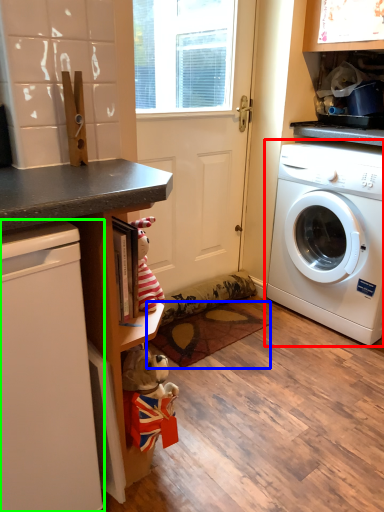
Question: Which is farther away from washing machine (highlighted by a red box)? mat (highlighted by a blue box) or dish washer (highlighted by a green box)?

Choices:
 (A) mat
 (B) dish washer

Answer: (B)